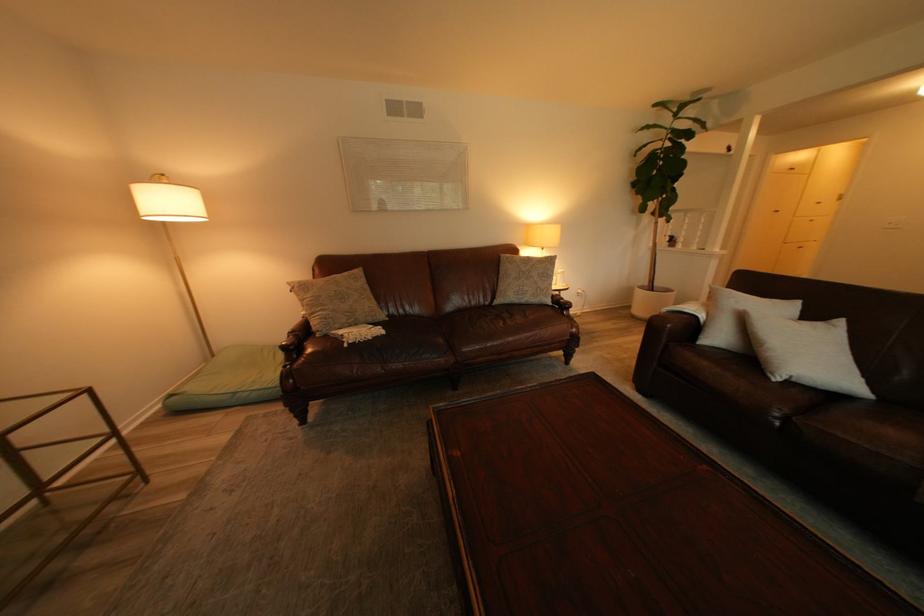
Describe the element at coordinates (453, 336) in the screenshot. I see `the brown sofa surface` at that location.